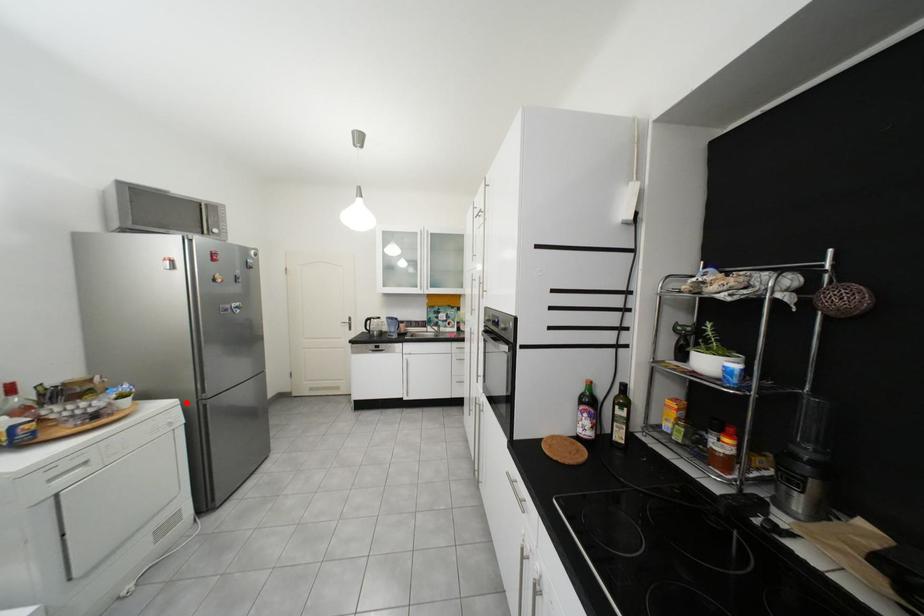
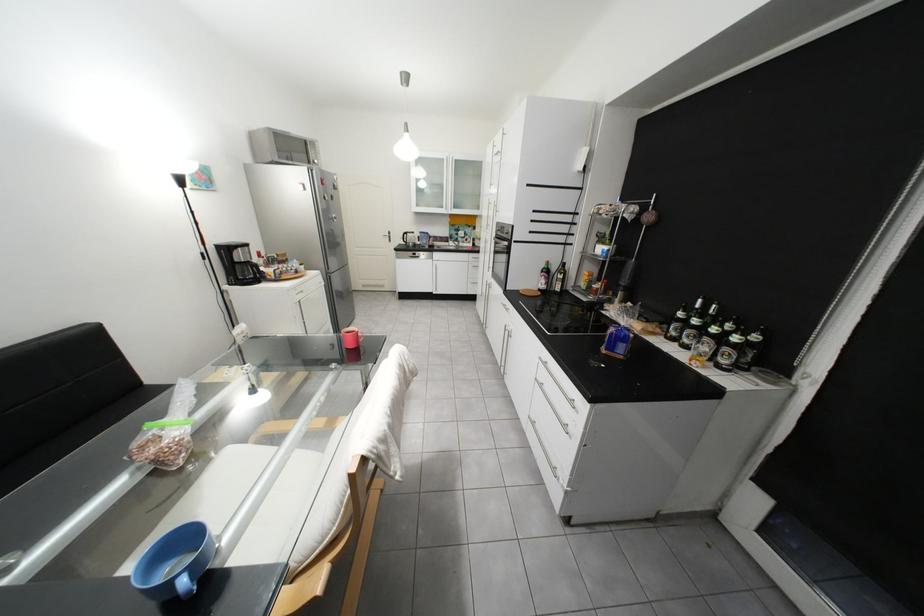
Question: I am providing you with two images of the same scene from different viewpoints. In image1, a red point is highlighted. Considering the same 3D point in image2, which of the following is correct?

Choices:
 (A) It is closer
 (B) It is farther

Answer: (A)